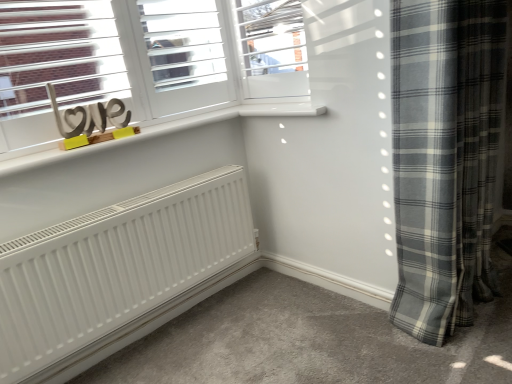
Describe the element at coordinates (445, 158) in the screenshot. This screenshot has height=384, width=512. I see `gray plaid curtain at right` at that location.

Image resolution: width=512 pixels, height=384 pixels. Identify the location of wooden love sign at upper left. (88, 116).

Measure the distance between point [267,45] and camera.

A distance of 5.96 feet exists between point [267,45] and camera.

At what (x,y) coordinates should I click in order to perform the action: click on gray plaid curtain at right. Please return your answer as a coordinate pair (x, y). The height and width of the screenshot is (384, 512). Looking at the image, I should click on (445, 158).

From a real-world perspective, is wooden love sign at upper left physically located above or below gray plaid curtain at right?

From a real-world perspective, wooden love sign at upper left is physically above gray plaid curtain at right.

Does wooden love sign at upper left lie in front of gray plaid curtain at right?

No, it is not.

Does wooden love sign at upper left have a lesser width compared to gray plaid curtain at right?

Yes, wooden love sign at upper left is thinner than gray plaid curtain at right.

Is wooden love sign at upper left shorter than gray plaid curtain at right?

Yes.

Who is smaller, white frosted glass window at upper center or gray plaid curtain at right?

Smaller between the two is white frosted glass window at upper center.

Can you tell me how much white frosted glass window at upper center and gray plaid curtain at right differ in facing direction?

87.5 degrees separate the facing orientations of white frosted glass window at upper center and gray plaid curtain at right.

From the image's perspective, would you say white frosted glass window at upper center is shown under gray plaid curtain at right?

No, from the image's perspective, white frosted glass window at upper center is not beneath gray plaid curtain at right.

Who is shorter, white frosted glass window at upper center or gray plaid curtain at right?

white frosted glass window at upper center is shorter.

Is gray plaid curtain at right wider or thinner than white frosted glass window at upper center?

In the image, gray plaid curtain at right appears to be wider than white frosted glass window at upper center.

The width and height of the screenshot is (512, 384). I want to click on window on the left of gray plaid curtain at right, so click(273, 48).

Is gray plaid curtain at right aimed at white frosted glass window at upper center?

No, gray plaid curtain at right is not aimed at white frosted glass window at upper center.

From a real-world perspective, is gray plaid curtain at right positioned above or below white frosted glass window at upper center?

From a real-world perspective, gray plaid curtain at right is physically below white frosted glass window at upper center.

Does wooden love sign at upper left have a greater width compared to white frosted glass window at upper center?

In fact, wooden love sign at upper left might be narrower than white frosted glass window at upper center.

From the image's perspective, is wooden love sign at upper left below white frosted glass window at upper center?

Yes, from the image's perspective, wooden love sign at upper left is below white frosted glass window at upper center.

Is wooden love sign at upper left turned away from white frosted glass window at upper center?

No.

In the image, is wooden love sign at upper left positioned in front of or behind white frosted glass window at upper center?

Clearly, wooden love sign at upper left is in front of white frosted glass window at upper center.

Is gray plaid curtain at right placed right next to wooden love sign at upper left?

No, gray plaid curtain at right is not in contact with wooden love sign at upper left.

Is gray plaid curtain at right to the left of wooden love sign at upper left from the viewer's perspective?

No.

Is gray plaid curtain at right turned away from wooden love sign at upper left?

No.

Where is `curtain below the wooden love sign at upper left (from a real-world perspective)`? The image size is (512, 384). curtain below the wooden love sign at upper left (from a real-world perspective) is located at coordinates (445, 158).

Between white frosted glass window at upper center and wooden love sign at upper left, which one appears on the right side from the viewer's perspective?

white frosted glass window at upper center is more to the right.

Could you tell me if white frosted glass window at upper center is turned towards wooden love sign at upper left?

Yes, white frosted glass window at upper center is turned towards wooden love sign at upper left.

Based on the photo, is the surface of white frosted glass window at upper center in direct contact with wooden love sign at upper left?

They are not placed beside each other.

Which is correct: white frosted glass window at upper center is inside wooden love sign at upper left, or outside of it?

white frosted glass window at upper center is not inside wooden love sign at upper left, it's outside.

I want to click on curtain that is below the wooden love sign at upper left (from the image's perspective), so [x=445, y=158].

In order to click on curtain below the white frosted glass window at upper center (from a real-world perspective) in this screenshot , I will do `click(445, 158)`.

Based on their spatial positions, is gray plaid curtain at right or wooden love sign at upper left further from white frosted glass window at upper center?

wooden love sign at upper left is further to white frosted glass window at upper center.

When comparing their distances from wooden love sign at upper left, does gray plaid curtain at right or white frosted glass window at upper center seem further?

gray plaid curtain at right lies further to wooden love sign at upper left than the other object.

Looking at the image, which one is located closer to wooden love sign at upper left, white frosted glass window at upper center or gray plaid curtain at right?

white frosted glass window at upper center lies closer to wooden love sign at upper left than the other object.

From the image, which object appears to be nearer to white frosted glass window at upper center, wooden love sign at upper left or gray plaid curtain at right?

Among the two, gray plaid curtain at right is located nearer to white frosted glass window at upper center.

Looking at the image, which one is located further to gray plaid curtain at right, white frosted glass window at upper center or wooden love sign at upper left?

wooden love sign at upper left is positioned further to the anchor gray plaid curtain at right.

Considering their positions, is wooden love sign at upper left positioned closer to gray plaid curtain at right than white frosted glass window at upper center?

white frosted glass window at upper center is closer to gray plaid curtain at right.

Where is `window located between wooden love sign at upper left and gray plaid curtain at right in the left-right direction`? window located between wooden love sign at upper left and gray plaid curtain at right in the left-right direction is located at coordinates (273, 48).